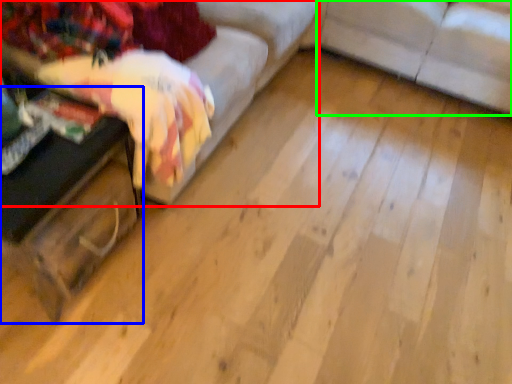
Question: Which is nearer to the studio couch (highlighted by a red box)? table (highlighted by a blue box) or studio couch (highlighted by a green box).

Choices:
 (A) table
 (B) studio couch

Answer: (A)